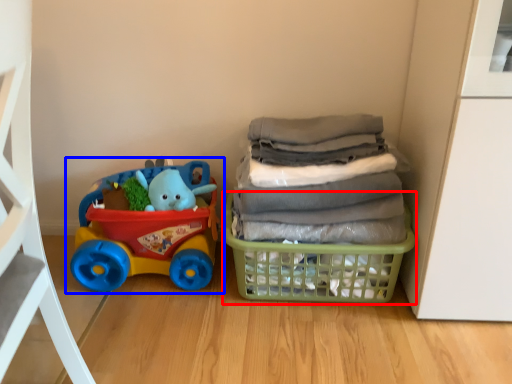
Question: Among these objects, which one is nearest to the camera, basket (highlighted by a red box) or toy (highlighted by a blue box)?

Choices:
 (A) basket
 (B) toy

Answer: (A)